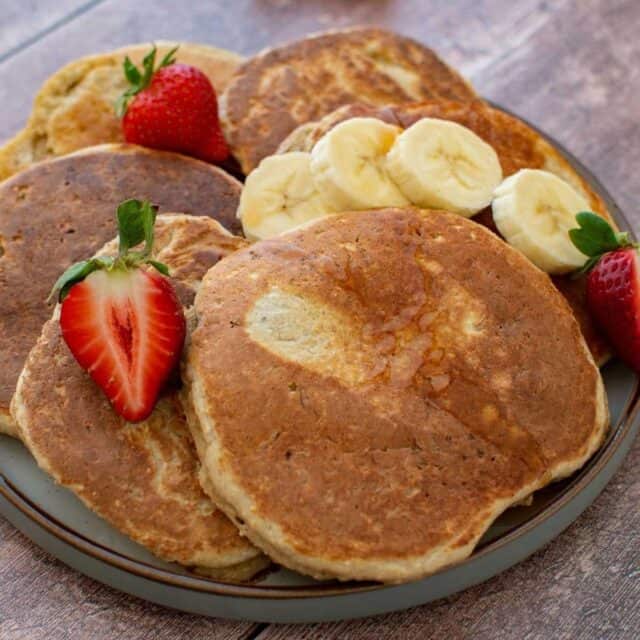
At what (x,y) coordinates should I click in order to perform the action: click on table. Please return your answer as a coordinate pair (x, y). Looking at the image, I should click on (564, 589).